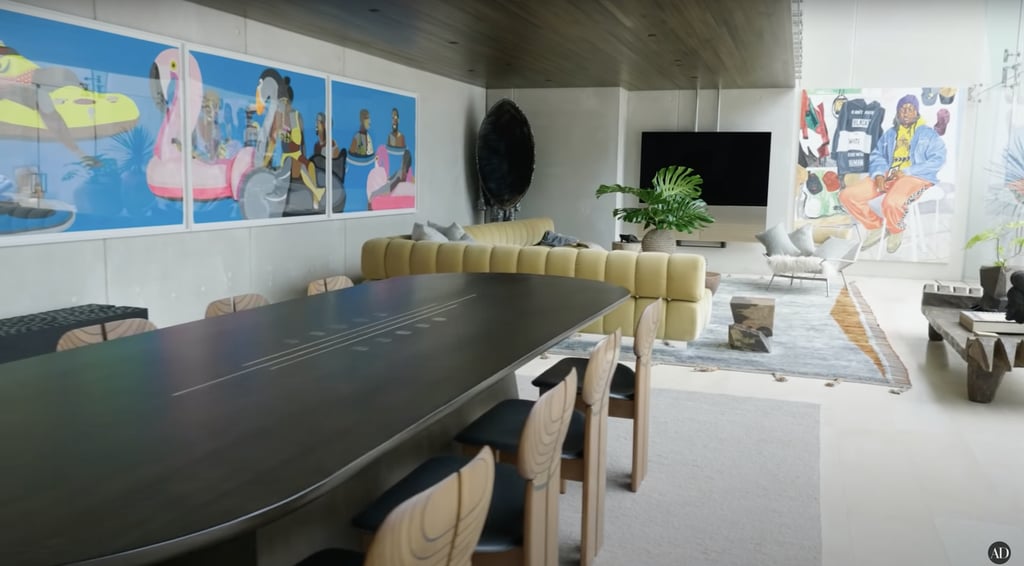
This screenshot has width=1024, height=566. What are the coordinates of `yellow sofa` in the screenshot? It's located at (623, 268).